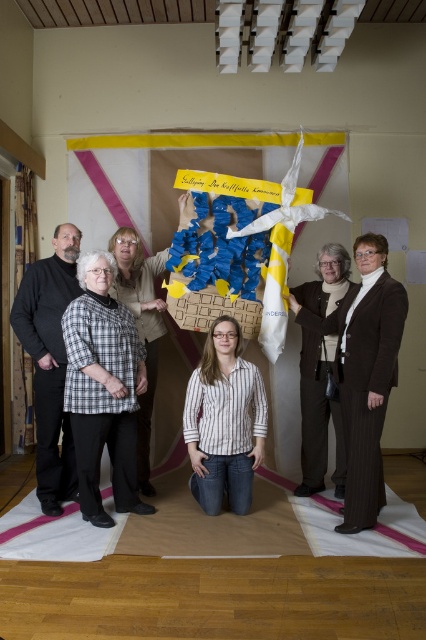
Does brown woolen sweater at center have a larger size compared to striped shirt at center?

Yes.

This screenshot has height=640, width=426. I want to click on brown woolen sweater at center, so click(319, 416).

Identify the location of brown woolen sweater at center. (319, 416).

Which is above, plaid fabric shirt at left or striped cotton shirt at center?

plaid fabric shirt at left

Who is more distant from viewer, (85, 468) or (258, 381)?

The point (258, 381) is behind.

The height and width of the screenshot is (640, 426). Find the location of `plaid fabric shirt at left`. plaid fabric shirt at left is located at coordinates (103, 388).

Which is more to the left, plaid fabric shirt at left or striped shirt at center?

Positioned to the left is plaid fabric shirt at left.

Who is positioned more to the right, plaid fabric shirt at left or striped shirt at center?

From the viewer's perspective, striped shirt at center appears more on the right side.

Locate an element on the screen. Image resolution: width=426 pixels, height=640 pixels. plaid fabric shirt at left is located at coordinates (103, 388).